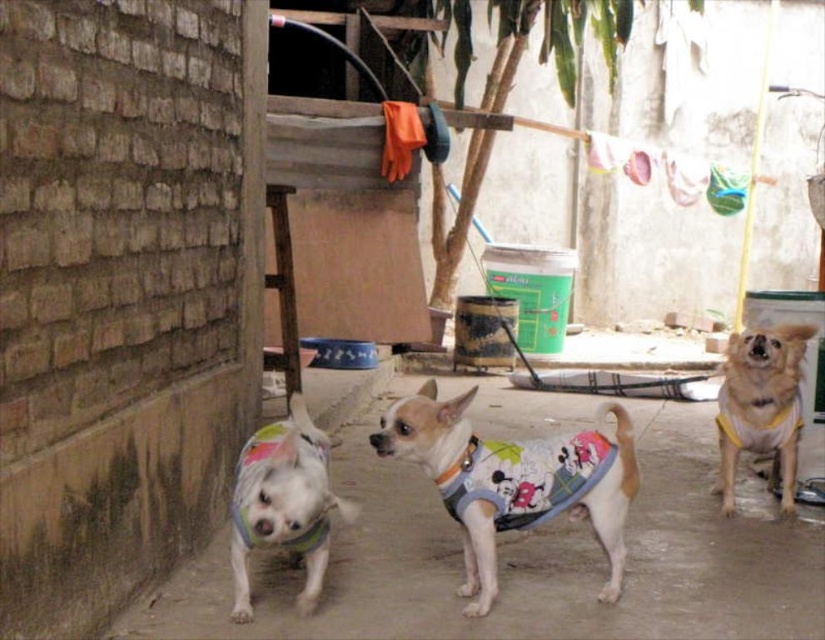
You are a photographer trying to capture a clear photo of the white fabric dog at center and the white soft fabric dog at center. Which one is closer to the camera?

The white fabric dog at center is closer to the camera because the white soft fabric dog at center is behind it.

You are a dog owner who wants to place both the white fabric dog at center and the yellow fabric dog at center on a narrow shelf. Which dog should you place first to ensure both can fit?

You should place the white fabric dog at center first since it is wider than the yellow fabric dog at center, allowing enough space for the narrower yellow fabric dog at center afterward.

You are a dog owner who wants to buy a new dog bed for your dogs. You see the white fabric dog at center and the yellow fabric dog at center in the image. Which dog requires a larger bed based on their size?

The white fabric dog at center requires a larger bed because it is bigger than the yellow fabric dog at center.